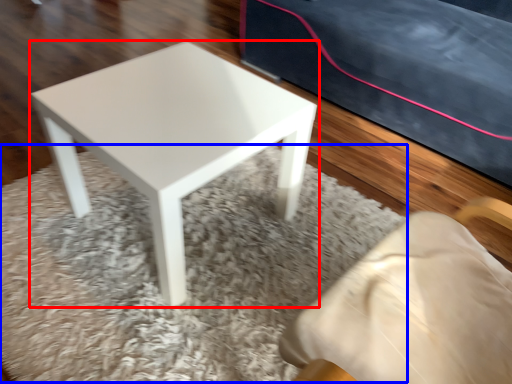
Question: Which of the following is the closest to the observer, stool (highlighted by a red box) or mat (highlighted by a blue box)?

Choices:
 (A) stool
 (B) mat

Answer: (B)